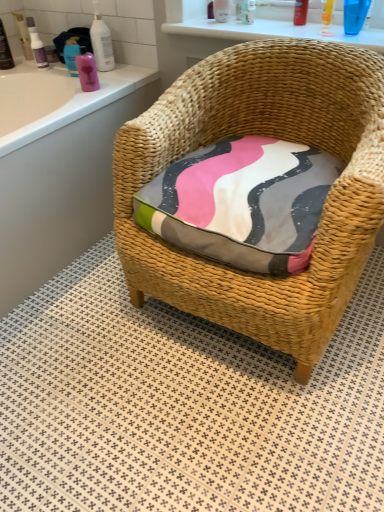
This screenshot has height=512, width=384. Find the location of `unoccupied area in front of transparent plastic cup at upper right, placed as the tenth toiletry when sorted from left to right`. unoccupied area in front of transparent plastic cup at upper right, placed as the tenth toiletry when sorted from left to right is located at coordinates (364, 36).